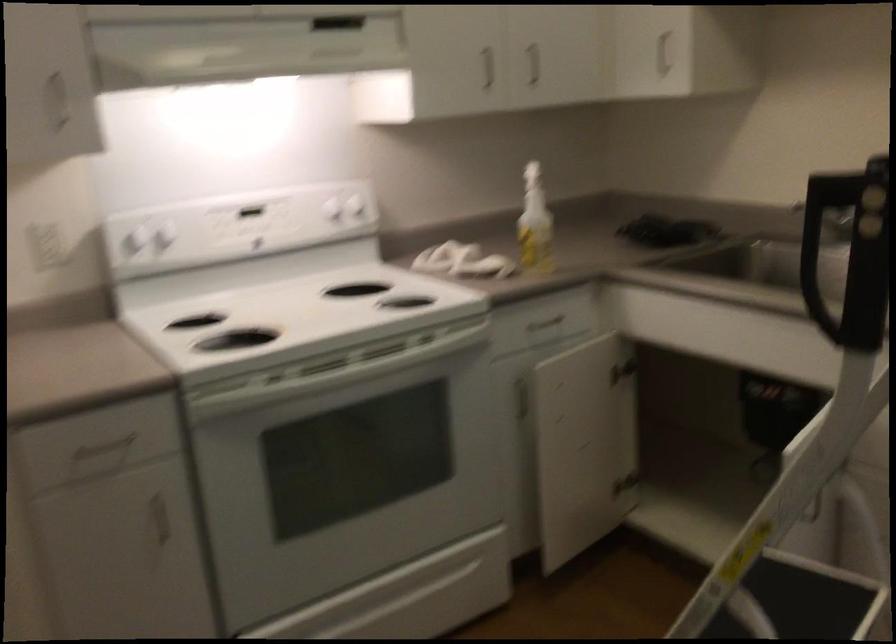
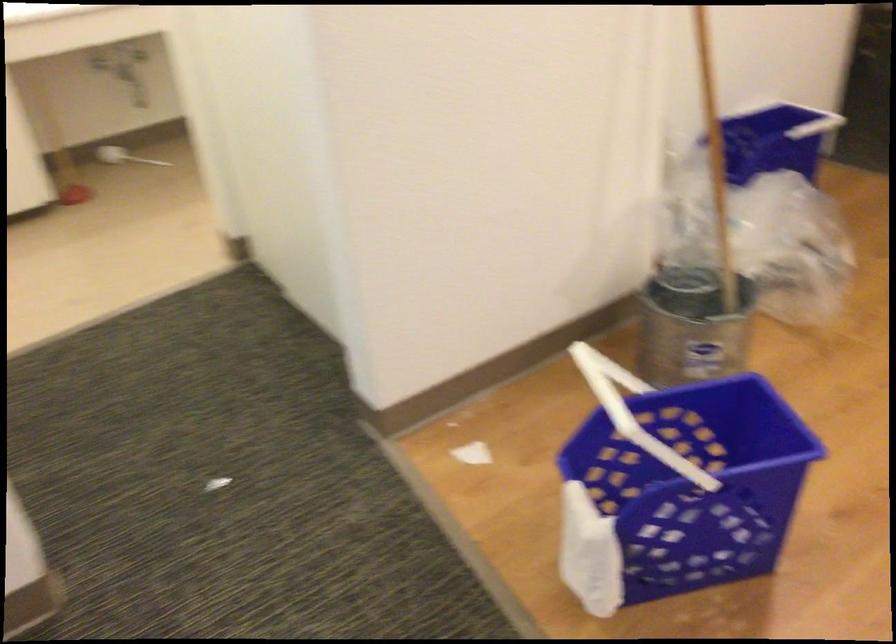
How did the camera likely rotate?

The camera rotated toward left-down.